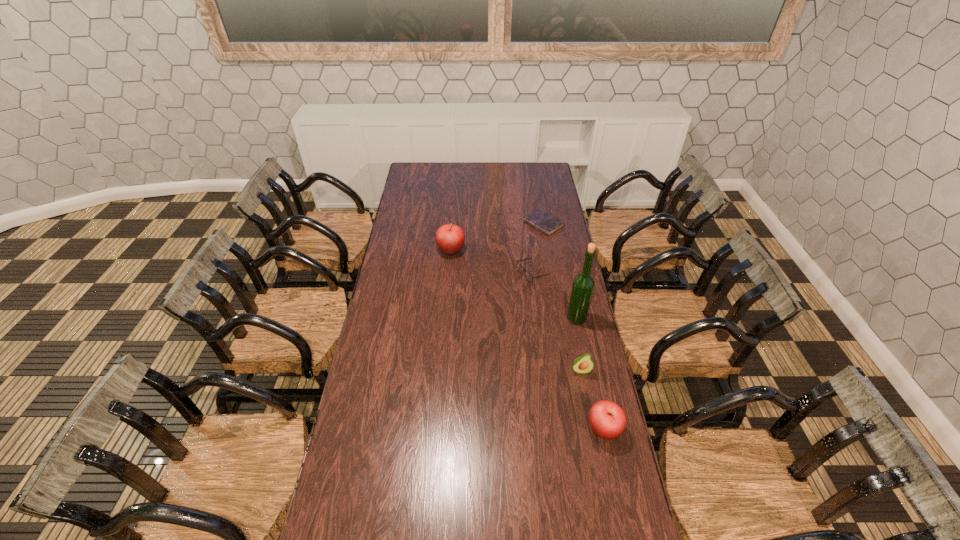
The image size is (960, 540). I want to click on the leftmost object, so click(x=450, y=238).

The width and height of the screenshot is (960, 540). Identify the location of the left apple. (450, 238).

This screenshot has height=540, width=960. In order to click on the nearest object in this screenshot , I will do `click(607, 419)`.

You are a GUI agent. You are given a task and a screenshot of the screen. Output one action in this format:
    pyautogui.click(x=<x>, y=<y>)
    Task: Click on the nearer apple
    
    Given the screenshot: What is the action you would take?
    pyautogui.click(x=607, y=419)

The height and width of the screenshot is (540, 960). What are the coordinates of `the fifth tallest object` in the screenshot? It's located at pyautogui.click(x=528, y=276).

Where is `the fourth nearest object`? the fourth nearest object is located at coordinates (528, 276).

Identify the location of the tallest object. This screenshot has height=540, width=960. (583, 285).

At what (x,y) coordinates should I click in order to perform the action: click on the third nearest object. Please return your answer as a coordinate pair (x, y). The image size is (960, 540). Looking at the image, I should click on pos(583,285).

Where is `the shortest object`? This screenshot has width=960, height=540. the shortest object is located at coordinates (541, 220).

You are a GUI agent. You are given a task and a screenshot of the screen. Output one action in this format:
    pyautogui.click(x=<x>, y=<y>)
    Task: Click on the farthest object
    This screenshot has width=960, height=540.
    Given the screenshot: What is the action you would take?
    pyautogui.click(x=541, y=220)